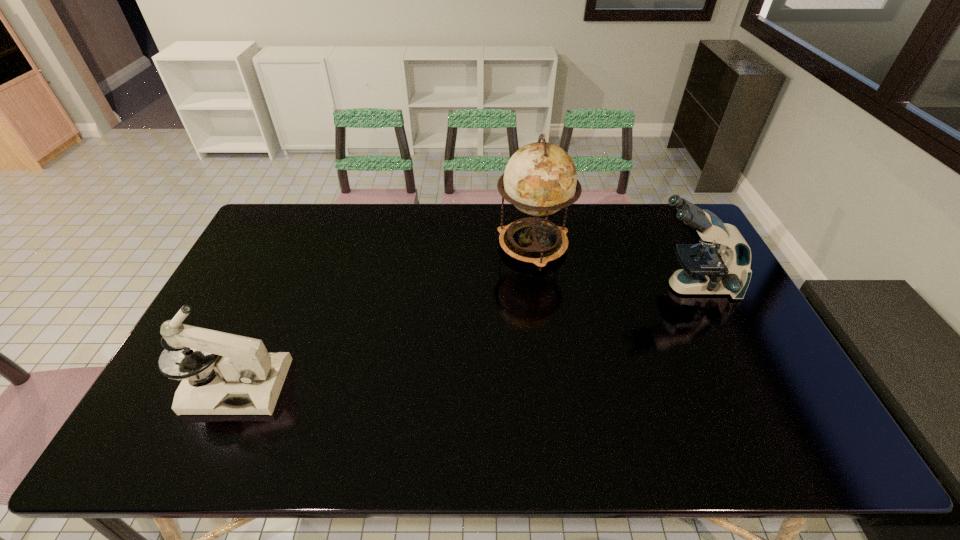
Identify the location of empty location between the globe and the left microscope. point(384,316).

The image size is (960, 540). In order to click on free area in between the right microscope and the globe in this screenshot , I will do `click(612, 267)`.

I want to click on free space between the farther microscope and the nearer microscope, so click(463, 336).

Locate an element on the screen. Image resolution: width=960 pixels, height=540 pixels. free area in between the leftmost object and the globe is located at coordinates (384, 316).

At what (x,y) coordinates should I click in order to perform the action: click on vacant point located between the leftmost object and the globe. Please return your answer as a coordinate pair (x, y). Looking at the image, I should click on (384, 316).

Identify the location of free space between the tallest object and the nearer microscope. The image size is (960, 540). (384, 316).

Locate an element on the screen. free spot between the farther microscope and the second object from right to left is located at coordinates (612, 267).

Find the location of `blank region between the tallest object and the right microscope`. blank region between the tallest object and the right microscope is located at coordinates (612, 267).

Image resolution: width=960 pixels, height=540 pixels. Find the location of `free space between the rightmost object and the nearer microscope`. free space between the rightmost object and the nearer microscope is located at coordinates (463, 336).

Find the location of a particular element. vacant point located between the second object from left to right and the left microscope is located at coordinates (384, 316).